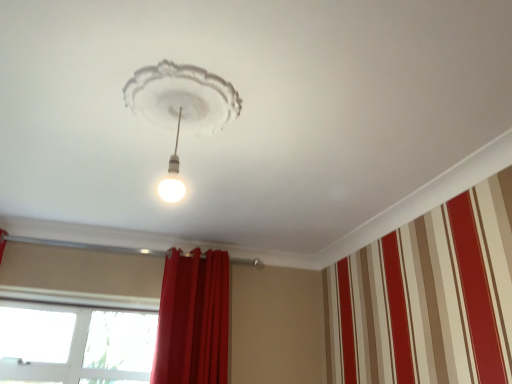
Describe the element at coordinates (193, 320) in the screenshot. Image resolution: width=512 pixels, height=384 pixels. I see `red velvet curtain at center` at that location.

In order to face white glossy light bulb at center, should I rotate leftwards or rightwards?

You should rotate left by 9.904 degrees.

This screenshot has width=512, height=384. I want to click on red velvet curtain at center, so click(193, 320).

Which is in front, point (129, 79) or point (197, 263)?

The point (129, 79) is in front.

From the image's perspective, between white glossy light bulb at center and red velvet curtain at center, which one is located above?

From the image's view, white glossy light bulb at center is above.

In the image, is white glossy light bulb at center positioned in front of or behind red velvet curtain at center?

white glossy light bulb at center is positioned closer to the viewer than red velvet curtain at center.

Measure the distance from transparent glass window at lower left to white glossy light bulb at center.

A distance of 1.70 meters exists between transparent glass window at lower left and white glossy light bulb at center.

From a real-world perspective, which is physically above, transparent glass window at lower left or white glossy light bulb at center?

From a 3D spatial view, white glossy light bulb at center is above.

Is the depth of transparent glass window at lower left less than that of white glossy light bulb at center?

No, transparent glass window at lower left is further to the viewer.

Which object is wider, transparent glass window at lower left or white glossy light bulb at center?

white glossy light bulb at center is wider.

Considering the sizes of objects white glossy light bulb at center and transparent glass window at lower left in the image provided, who is taller, white glossy light bulb at center or transparent glass window at lower left?

transparent glass window at lower left is taller.

Does white glossy light bulb at center have a smaller size compared to transparent glass window at lower left?

Actually, white glossy light bulb at center might be larger than transparent glass window at lower left.

Is point (200, 105) closer to viewer compared to point (91, 310)?

That is True.

Is red velvet curtain at center aimed at white glossy light bulb at center?

Yes.

Is red velvet curtain at center in front of or behind white glossy light bulb at center in the image?

In the image, red velvet curtain at center appears behind white glossy light bulb at center.

What's the angular difference between red velvet curtain at center and white glossy light bulb at center's facing directions?

The angular difference between red velvet curtain at center and white glossy light bulb at center is 0.672 degrees.

Does red velvet curtain at center have a lesser height compared to white glossy light bulb at center?

In fact, red velvet curtain at center may be taller than white glossy light bulb at center.

Is transparent glass window at lower left facing towards red velvet curtain at center?

No, transparent glass window at lower left is not facing towards red velvet curtain at center.

Which object is positioned more to the left, transparent glass window at lower left or red velvet curtain at center?

From the viewer's perspective, transparent glass window at lower left appears more on the left side.

Measure the distance between transparent glass window at lower left and red velvet curtain at center.

transparent glass window at lower left and red velvet curtain at center are 22.12 inches apart from each other.

Is transparent glass window at lower left taller or shorter than red velvet curtain at center?

Considering their sizes, transparent glass window at lower left has less height than red velvet curtain at center.

This screenshot has height=384, width=512. In order to click on curtain above the transparent glass window at lower left (from the image's perspective) in this screenshot , I will do `click(193, 320)`.

In the scene shown: From a real-world perspective, is red velvet curtain at center physically located above or below transparent glass window at lower left?

red velvet curtain at center is above transparent glass window at lower left.

Considering the sizes of objects red velvet curtain at center and transparent glass window at lower left in the image provided, who is bigger, red velvet curtain at center or transparent glass window at lower left?

red velvet curtain at center is bigger.

Are red velvet curtain at center and transparent glass window at lower left far apart?

They are positioned close to each other.

Identify the location of lamp above the red velvet curtain at center (from a real-world perspective). (181, 107).

Identify the location of window that is on the left side of white glossy light bulb at center. (74, 343).

When comparing their distances from transparent glass window at lower left, does white glossy light bulb at center or red velvet curtain at center seem further?

white glossy light bulb at center lies further to transparent glass window at lower left than the other object.

Considering their positions, is red velvet curtain at center positioned further to transparent glass window at lower left than white glossy light bulb at center?

white glossy light bulb at center lies further to transparent glass window at lower left than the other object.

Based on their spatial positions, is transparent glass window at lower left or red velvet curtain at center further from white glossy light bulb at center?

The object further to white glossy light bulb at center is transparent glass window at lower left.

Which object lies further to the anchor point white glossy light bulb at center, red velvet curtain at center or transparent glass window at lower left?

transparent glass window at lower left is positioned further to the anchor white glossy light bulb at center.

From the image, which object appears to be nearer to red velvet curtain at center, white glossy light bulb at center or transparent glass window at lower left?

Among the two, transparent glass window at lower left is located nearer to red velvet curtain at center.

From the image, which object appears to be nearer to red velvet curtain at center, transparent glass window at lower left or white glossy light bulb at center?

transparent glass window at lower left.

You are a GUI agent. You are given a task and a screenshot of the screen. Output one action in this format:
    pyautogui.click(x=<x>, y=<y>)
    Task: Click on the curtain between white glossy light bulb at center and transparent glass window at lower left along the z-axis
    
    Given the screenshot: What is the action you would take?
    pyautogui.click(x=193, y=320)